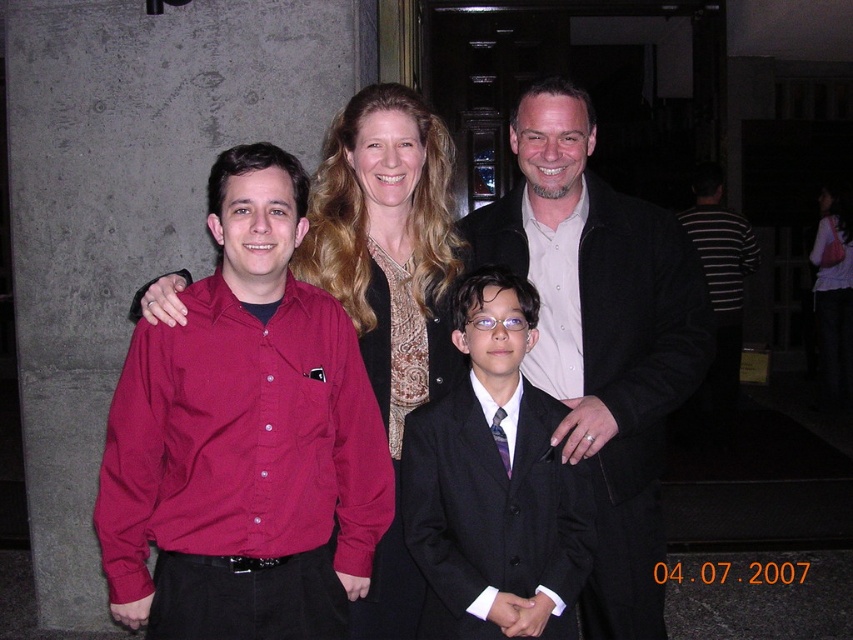
You are standing at the point with coordinates point (305, 275) and want to move to the point with coordinates point (436, 595). Given the scene described, will you need to walk around any obstacles or can you walk directly towards your destination?

Point (436, 595) is in front of point (305, 275), so you can walk directly towards your destination without needing to go around any obstacles.

You are a photographer trying to arrange the two adults in the image so that the matte black suit at center and the striped cotton shirt at right are aligned properly. According to their current positions, which adult should move to the left to create a balanced formation?

The striped cotton shirt at right should move to the left because the matte black suit at center is already positioned on its left side, so moving the striped cotton shirt at right leftward would align them correctly.